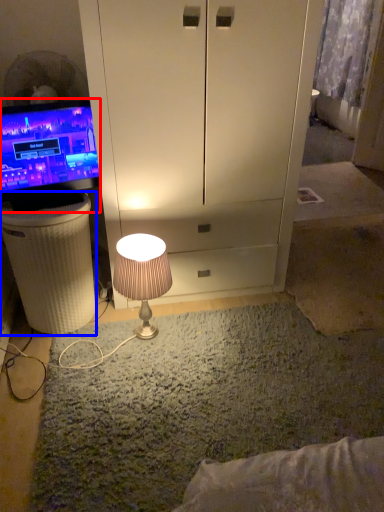
Question: Which object is further to the camera taking this photo, television (highlighted by a red box) or vanity (highlighted by a blue box)?

Choices:
 (A) television
 (B) vanity

Answer: (B)